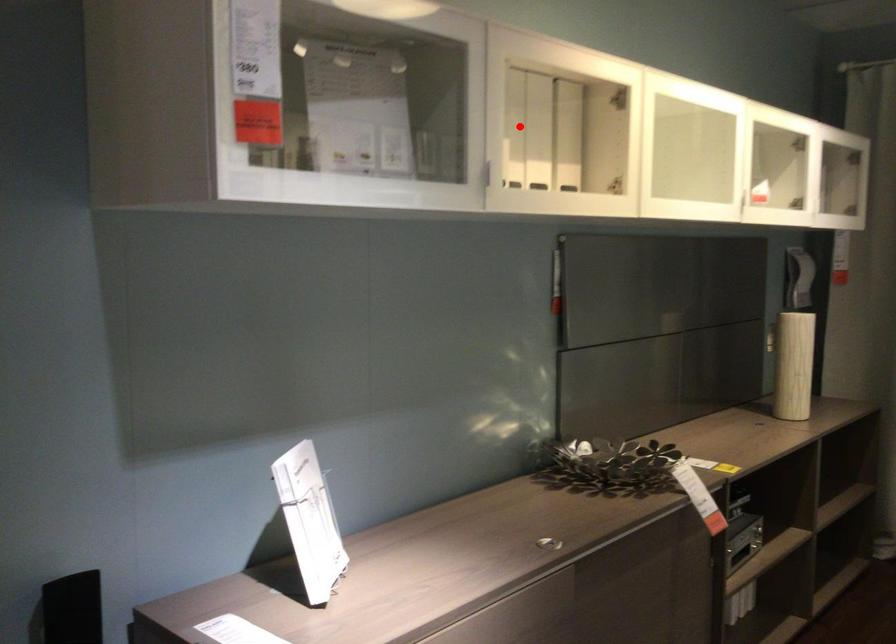
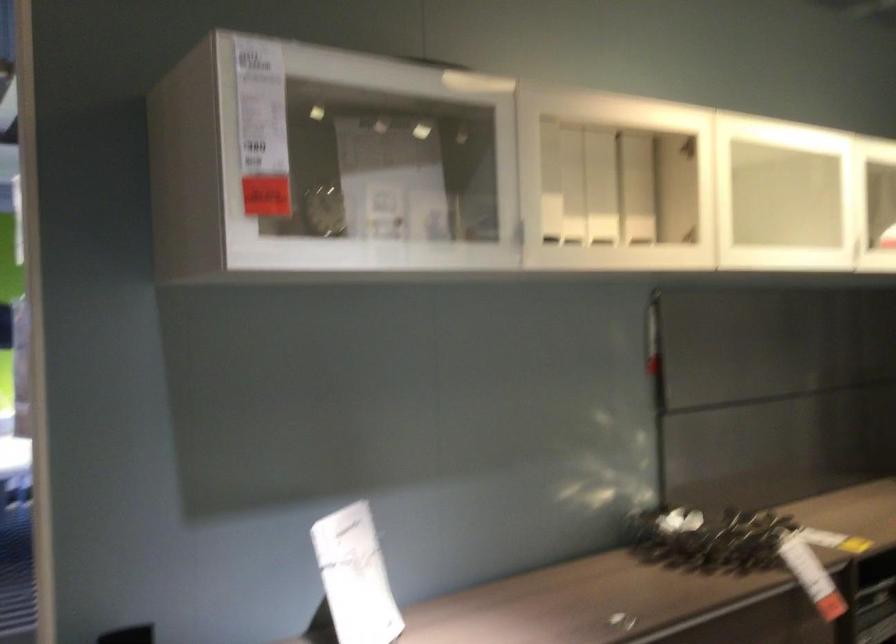
Question: I am providing you with two images of the same scene from different viewpoints. A red point is marked on the first image. At the location where the point appears in image 1, is it still visible in image 2?

Choices:
 (A) Yes
 (B) No

Answer: (A)